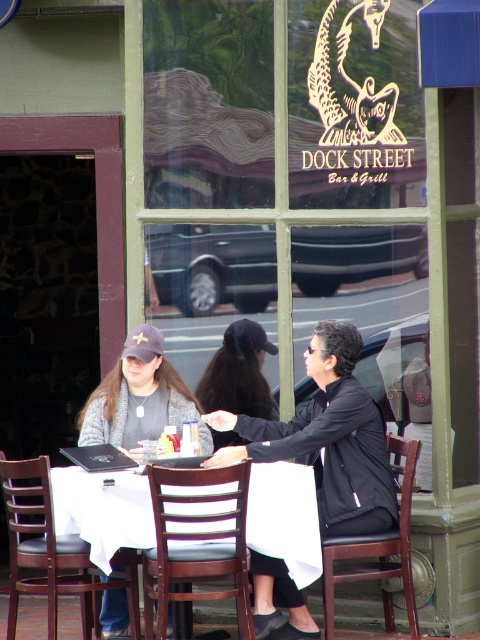
Question: Is white cloth at lower center wider than matte gray cap at left?

Choices:
 (A) yes
 (B) no

Answer: (B)

Question: Which point appears closest to the camera in this image?

Choices:
 (A) (264, 531)
 (B) (240, 394)
 (C) (344, 472)
 (D) (207, 433)

Answer: (A)

Question: Is matte black jacket at center wider than dark brown hair at center?

Choices:
 (A) yes
 (B) no

Answer: (A)

Question: Estimate the real-world distances between objects in this image. Which object is closer to the white cloth at lower center?

Choices:
 (A) matte black jacket at center
 (B) matte gray cap at left

Answer: (B)

Question: Is matte gray cap at left smaller than dark brown hair at center?

Choices:
 (A) no
 (B) yes

Answer: (A)

Question: Which of the following is the closest to the observer?

Choices:
 (A) (260, 353)
 (B) (134, 397)
 (C) (59, 468)
 (D) (291, 630)

Answer: (C)